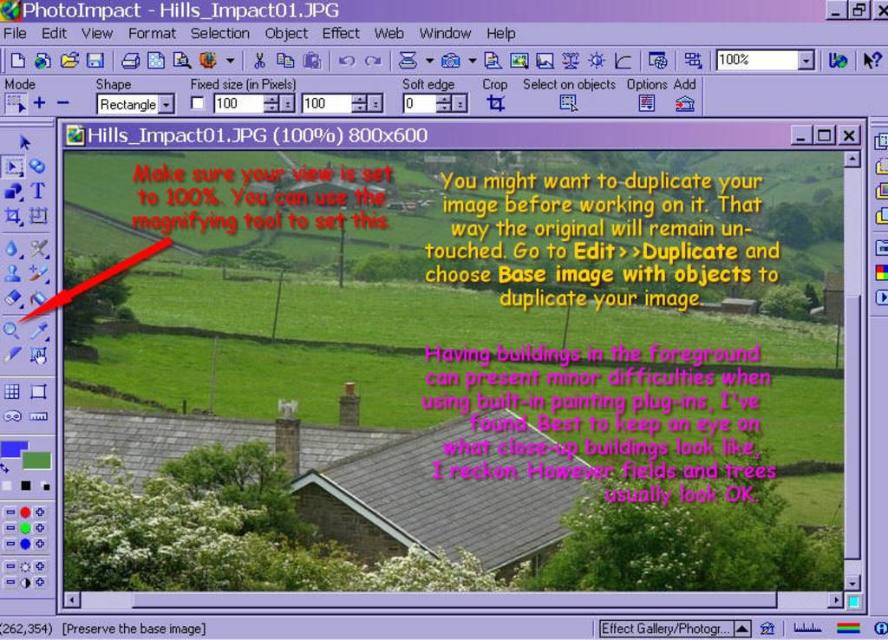
Question: Which object is closer to the camera taking this photo?

Choices:
 (A) red text at upper left
 (B) pink paper at upper center
 (C) yellow text at upper center

Answer: (B)

Question: Does yellow text at upper center appear on the left side of red text at upper left?

Choices:
 (A) yes
 (B) no

Answer: (B)

Question: Is yellow text at upper center to the left of red text at upper left from the viewer's perspective?

Choices:
 (A) yes
 (B) no

Answer: (B)

Question: Which object appears closest to the camera in this image?

Choices:
 (A) yellow text at upper center
 (B) red text at upper left

Answer: (A)

Question: Which point appears closest to the camera in this image?

Choices:
 (A) (716, 243)
 (B) (714, 461)
 (C) (349, 168)

Answer: (B)

Question: Can you confirm if yellow text at upper center is positioned above red text at upper left?

Choices:
 (A) yes
 (B) no

Answer: (B)